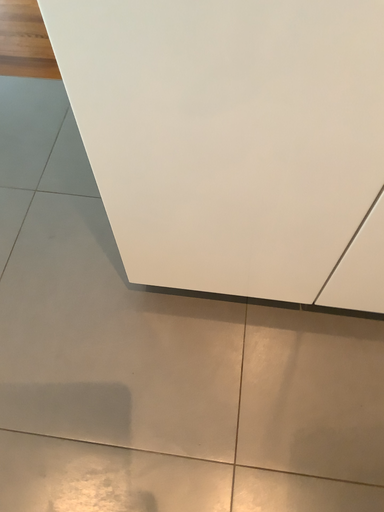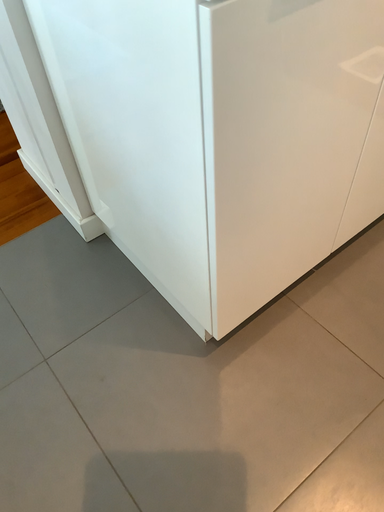
Question: Which way did the camera rotate in the video?

Choices:
 (A) rotated left
 (B) rotated right

Answer: (B)